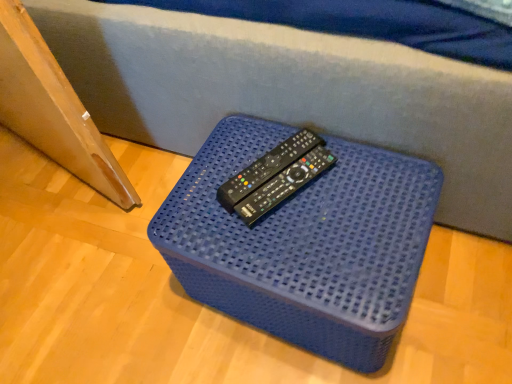
Identify the location of vacant point above blue plastic container at center (from a real-world perspective). (295, 199).